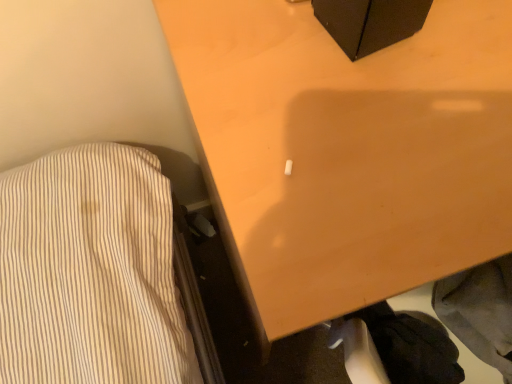
Question: Is point (346, 188) positioned closer to the camera than point (414, 352)?

Choices:
 (A) farther
 (B) closer

Answer: (B)

Question: From their relative heights in the image, would you say wooden table at center is taller or shorter than black fabric at lower right?

Choices:
 (A) tall
 (B) short

Answer: (A)

Question: From a real-world perspective, is wooden table at center physically located above or below black fabric at lower right?

Choices:
 (A) below
 (B) above

Answer: (A)

Question: Does point (426, 369) appear closer or farther from the camera than point (411, 129)?

Choices:
 (A) closer
 (B) farther

Answer: (B)

Question: Considering the positions of black fabric at lower right and wooden table at center in the image, is black fabric at lower right wider or thinner than wooden table at center?

Choices:
 (A) thin
 (B) wide

Answer: (A)

Question: From the image's perspective, is black fabric at lower right above or below wooden table at center?

Choices:
 (A) below
 (B) above

Answer: (A)

Question: From a real-world perspective, is black fabric at lower right physically located above or below wooden table at center?

Choices:
 (A) below
 (B) above

Answer: (B)